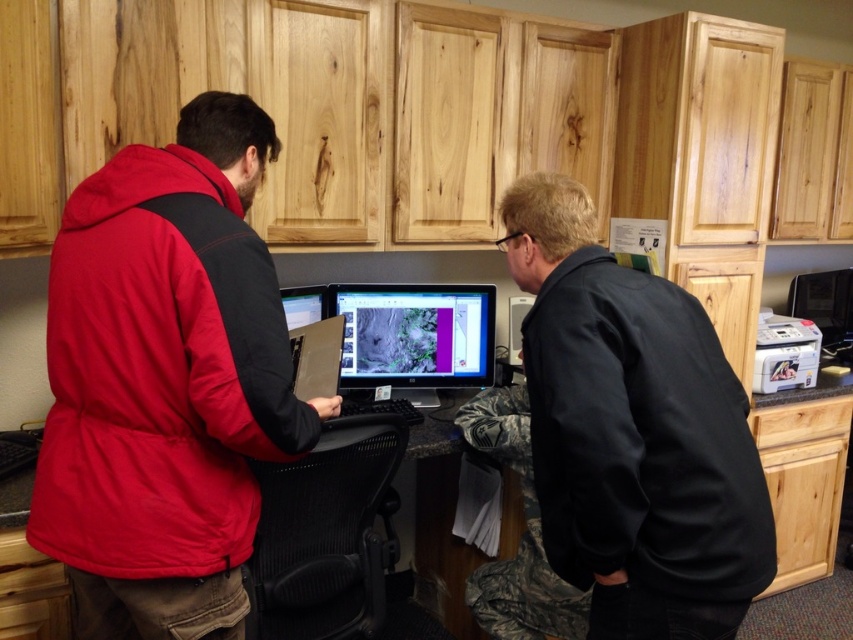
You are standing at the origin point of the coordinate system in the image. The person wearing the matte red jacket at left is at point (160, 372). If you want to walk directly to the matte red jacket at left, which direction should you move?

To reach the matte red jacket at left located at point (160, 372) from the origin, you should move towards the coordinates specified, which would be northeast direction if the x and y axes are standard.

You are a visitor in the office and want to greet the two people at the workstation. The person in the matte red jacket at left is facing forward, while the person in the black smooth jacket at lower right is turned slightly to the side. Which person should you approach first to avoid blocking their view of the monitors?

You should approach the person in the matte red jacket at left first because the black smooth jacket at lower right is behind them, so approaching the front person would avoid blocking the view of those behind.

You are a delivery robot with a package that needs to be placed on the desk between the matte red jacket at left and the matte black monitor at center. The package is 1.2 meters long. Can you fit the package horizontally on the desk between them?

The distance between the matte red jacket at left and the matte black monitor at center is 1.17 meters. Since the package is 1.2 meters long, it is slightly longer than the available space. Therefore, the package cannot be placed horizontally between them without overlapping either the jacket or the monitor.